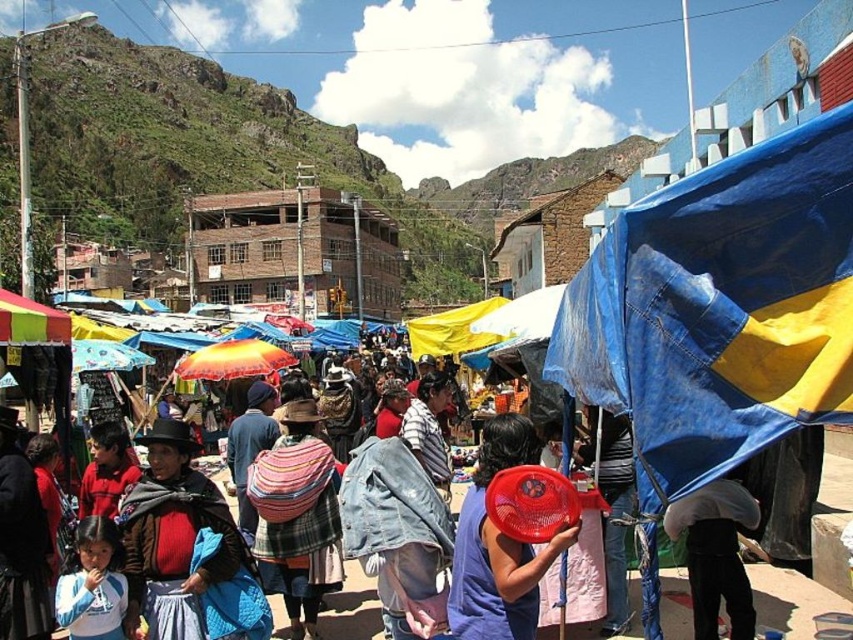
Question: Which point is closer to the camera taking this photo?

Choices:
 (A) (160, 556)
 (B) (235, 360)
 (C) (527, 442)
 (D) (567, 385)

Answer: (D)

Question: Estimate the real-world distances between objects in this image. Which object is closer to the yellow fabric canopy at left?

Choices:
 (A) blue tarpaulin at right
 (B) yellow fabric canopy at center
 (C) light blue fabric umbrella at lower right

Answer: (B)

Question: In this image, where is light blue fabric umbrella at lower right located relative to light blue fabric at lower left?

Choices:
 (A) above
 (B) below

Answer: (A)

Question: Is knitted wool sweater at center positioned behind plaid woolen shawl at center?

Choices:
 (A) yes
 (B) no

Answer: (B)

Question: Does light blue fabric umbrella at lower right appear on the right side of orange fabric umbrella at center?

Choices:
 (A) no
 (B) yes

Answer: (B)

Question: Which object is farther from the camera taking this photo?

Choices:
 (A) light blue fabric umbrella at lower right
 (B) yellow fabric canopy at center

Answer: (B)